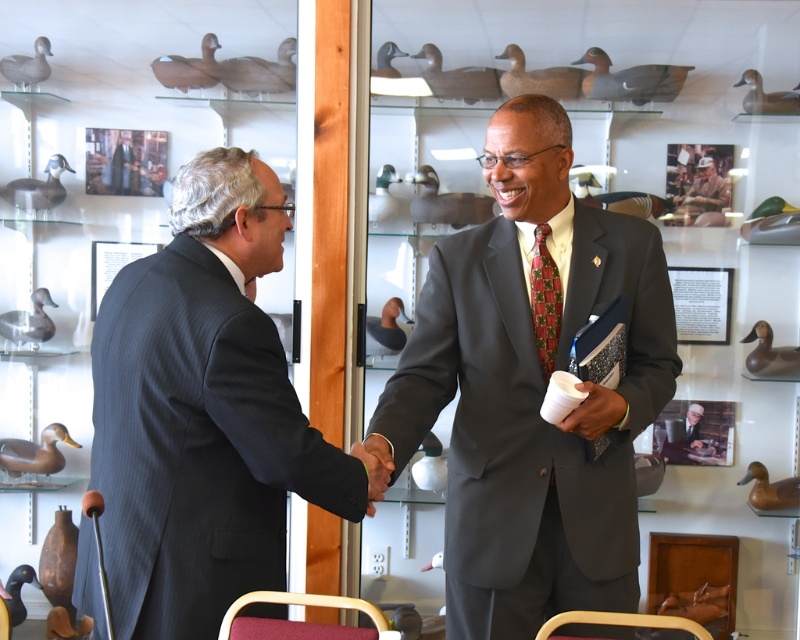
What are the coordinates of the dark gray suit at center?

The dark gray suit at center is located at point (204, 412).

You are a photographer trying to capture a portrait of the matte gray suit at center and the smooth wooden frame at center. If you want to ensure both subjects are in focus, which one should you adjust your camera focus to prioritize based on their sizes?

The matte gray suit at center is wider than the smooth wooden frame at center. To ensure both are in focus, prioritize focusing on the matte gray suit at center since it is larger and requires more detailed focus.